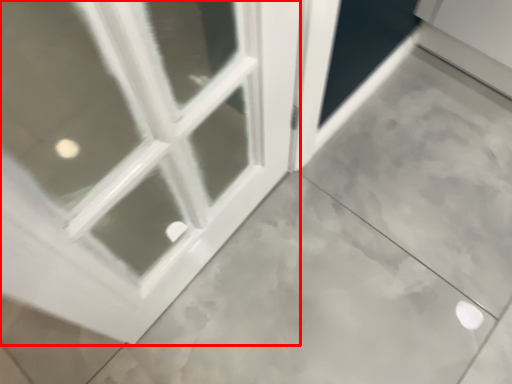
Question: From the image's perspective, considering the relative positions of window (annotated by the red box) and screen door in the image provided, where is window (annotated by the red box) located with respect to the staircase?

Choices:
 (A) below
 (B) above

Answer: (A)